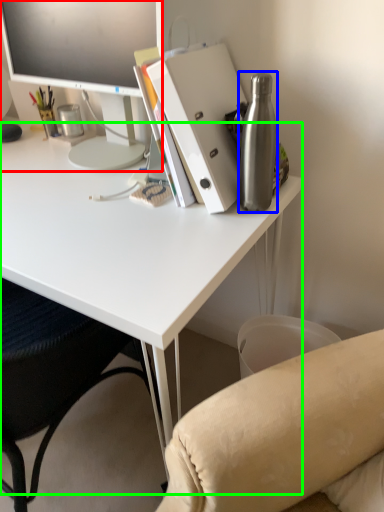
Question: Which object is positioned closest to television (highlighted by a red box)? Select from bottle (highlighted by a blue box) and desk (highlighted by a green box).

Choices:
 (A) bottle
 (B) desk

Answer: (B)